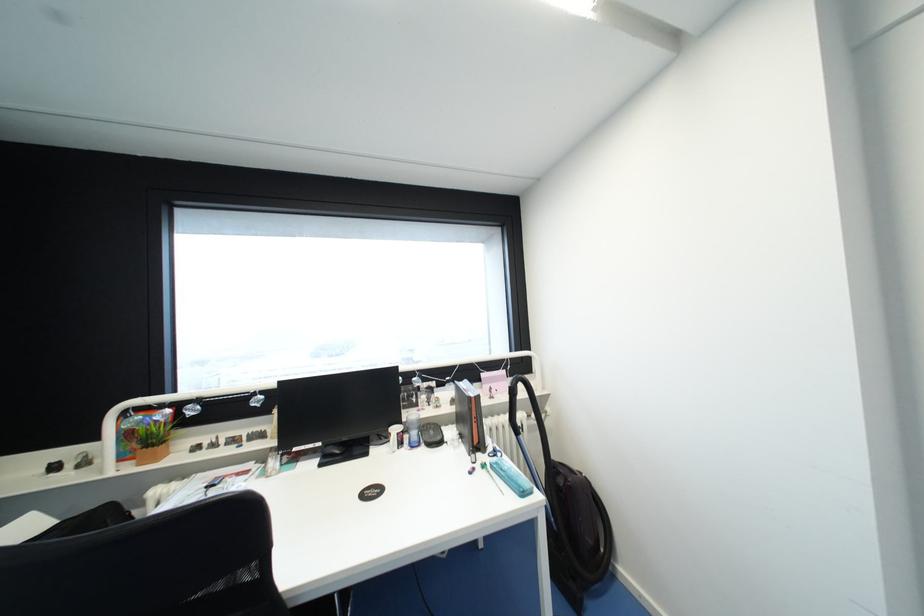
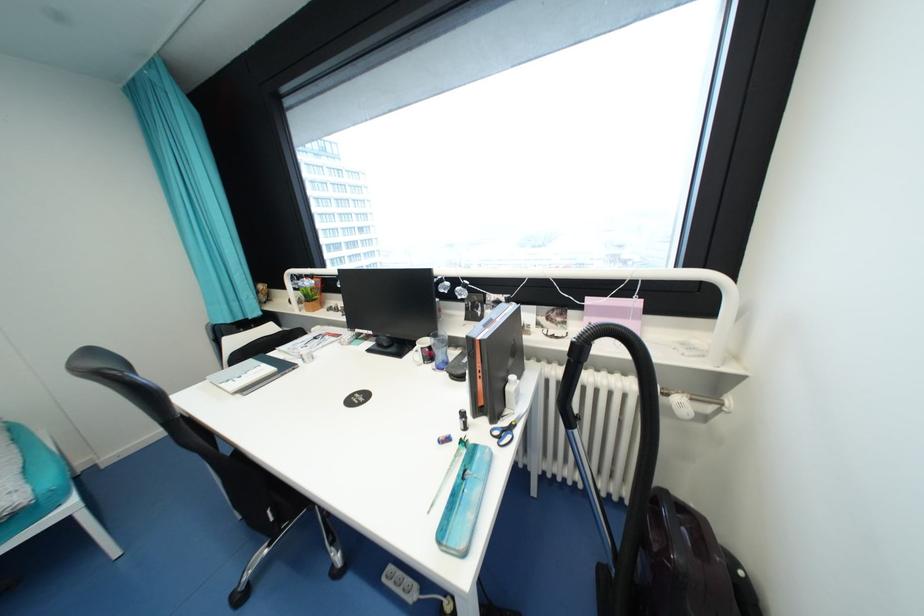
The first image is from the beginning of the video and the second image is from the end. How did the camera likely rotate when shooting the video?

The camera's rotation is toward left-down.